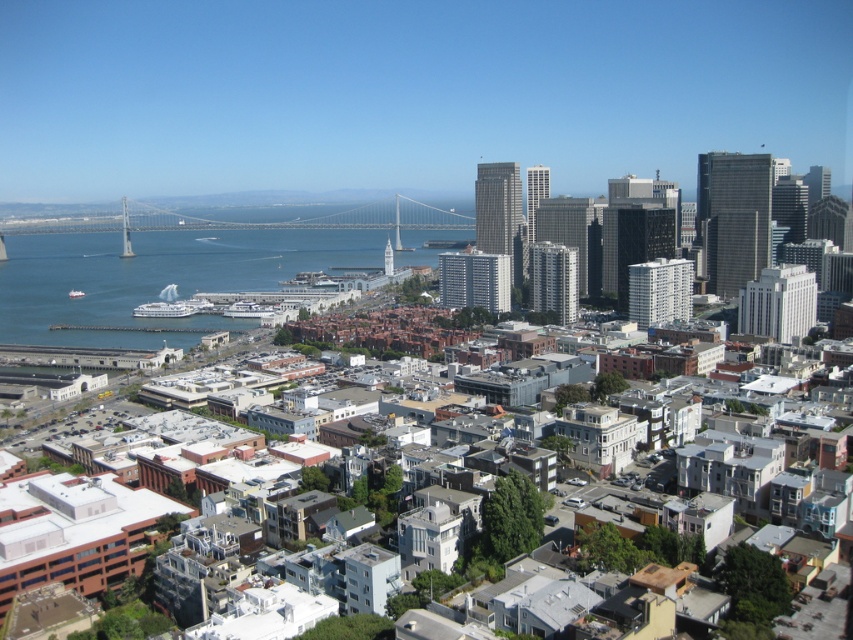
Question: Which object appears closest to the camera in this image?

Choices:
 (A) metallic gray bridge at center
 (B) blue water at lower left

Answer: (B)

Question: Which of these objects is positioned closest to the blue water at lower left?

Choices:
 (A) metallic gray bridge at center
 (B) white glossy cruise ship at center

Answer: (A)

Question: Considering the real-world distances, which object is closest to the white glossy cruise ship at lower left?

Choices:
 (A) blue water at lower left
 (B) white glossy cruise ship at center
 (C) metallic gray bridge at center

Answer: (B)

Question: Does metallic gray bridge at center come behind white glossy cruise ship at lower left?

Choices:
 (A) no
 (B) yes

Answer: (B)

Question: Does metallic gray bridge at center appear under white glossy cruise ship at lower left?

Choices:
 (A) no
 (B) yes

Answer: (A)

Question: Can you confirm if blue water at lower left is smaller than white glossy cruise ship at center?

Choices:
 (A) no
 (B) yes

Answer: (A)